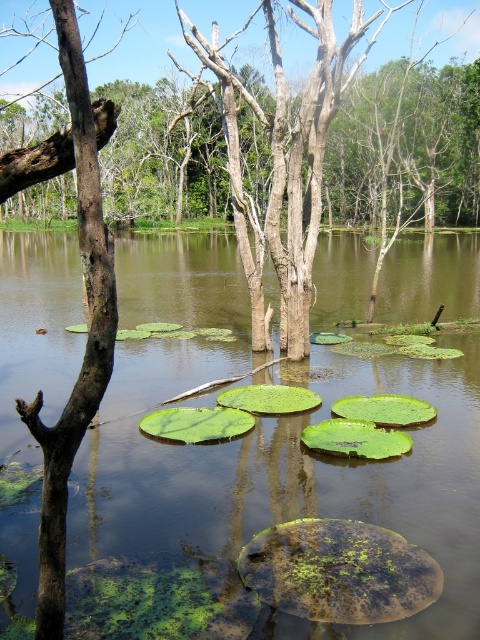
Question: Which object is closer to the camera taking this photo?

Choices:
 (A) smooth brown tree trunk at left
 (B) green leafy lily pads at center

Answer: (A)

Question: Can you confirm if green leafy lily pads at center is positioned below smooth brown tree trunk at left?

Choices:
 (A) no
 (B) yes

Answer: (B)

Question: Does green leafy lily pads at center appear on the left side of smooth brown tree trunk at left?

Choices:
 (A) yes
 (B) no

Answer: (B)

Question: Is green leafy lily pads at center bigger than smooth brown tree trunk at left?

Choices:
 (A) no
 (B) yes

Answer: (B)

Question: Which of the following is the farthest from the observer?

Choices:
 (A) green leafy lily pads at center
 (B) smooth brown tree trunk at left

Answer: (A)